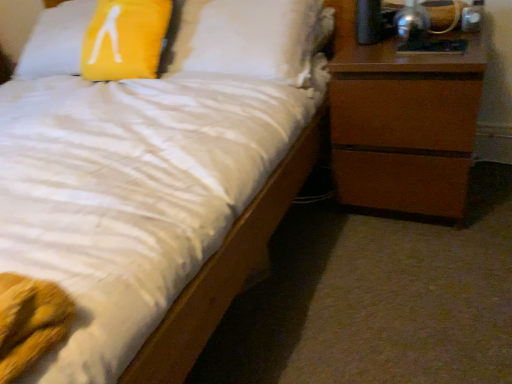
This screenshot has width=512, height=384. I want to click on unoccupied area in front of brown wood chest of drawers at right, so point(426,257).